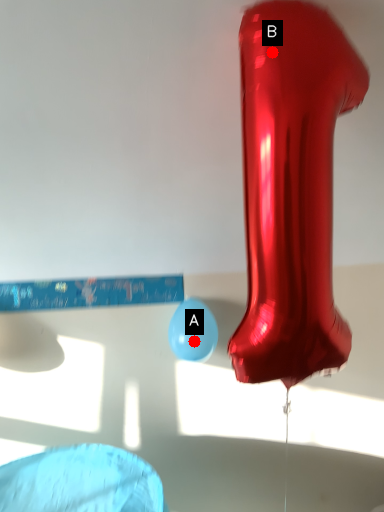
Question: Two points are circled on the image, labeled by A and B beside each circle. Which point is further to the camera?

Choices:
 (A) A is further
 (B) B is further

Answer: (A)